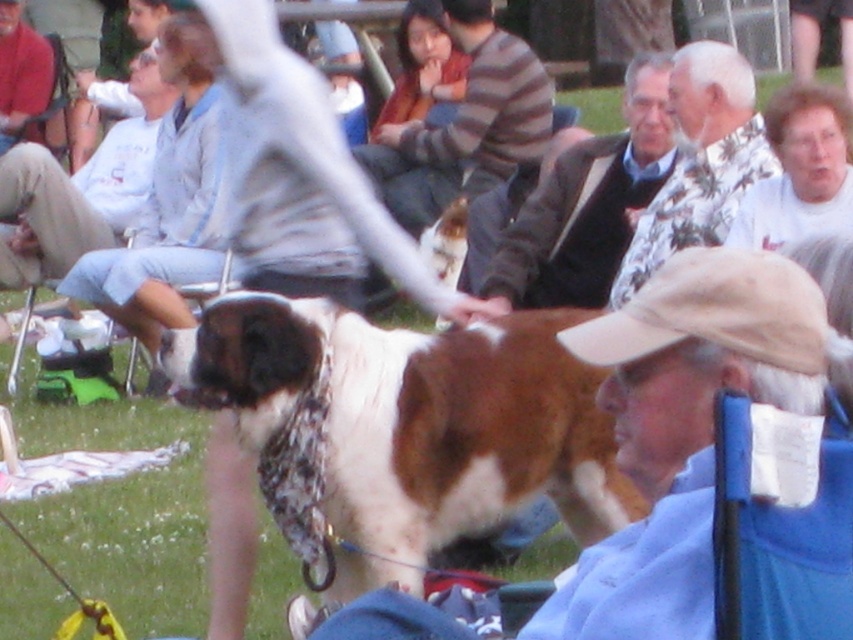
Question: Among these points, which one is farthest from the camera?

Choices:
 (A) (814, 180)
 (B) (577, 228)
 (C) (463, 509)

Answer: (B)

Question: Does floral-patterned sweater at center have a lesser width compared to floral shirt at upper right?

Choices:
 (A) yes
 (B) no

Answer: (B)

Question: Is floral shirt at upper right smaller than white cotton shirt at upper right?

Choices:
 (A) yes
 (B) no

Answer: (B)

Question: Among these points, which one is nearest to the camera?

Choices:
 (A) (496, 266)
 (B) (561, 481)
 (C) (733, 54)
 (D) (833, 90)

Answer: (B)

Question: Is floral shirt at upper right positioned at the back of white cotton shirt at upper right?

Choices:
 (A) yes
 (B) no

Answer: (A)

Question: Among these points, which one is farthest from the camera?

Choices:
 (A) (592, 198)
 (B) (743, 211)
 (C) (364, 326)

Answer: (A)